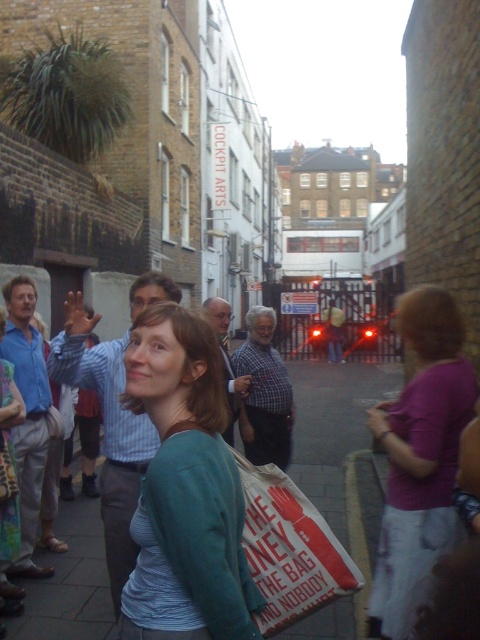
Question: Is matte green sweater at center below green fabric jacket at center?

Choices:
 (A) no
 (B) yes

Answer: (A)

Question: Which point is farther to the camera?

Choices:
 (A) (7, 412)
 (B) (325, 570)
 (C) (211, 372)
 (D) (456, 422)

Answer: (A)

Question: Can you confirm if purple fabric shirt at right is positioned to the right of white paper bag at center?

Choices:
 (A) no
 (B) yes

Answer: (B)

Question: Can you confirm if matte green sweater at center is smaller than purple fabric shirt at right?

Choices:
 (A) no
 (B) yes

Answer: (B)

Question: Which object appears farthest from the camera in this image?

Choices:
 (A) matte green sweater at center
 (B) white paper bag at center

Answer: (B)

Question: Which of the following is the closest to the observer?

Choices:
 (A) (416, 374)
 (B) (2, 410)
 (C) (205, 580)

Answer: (C)